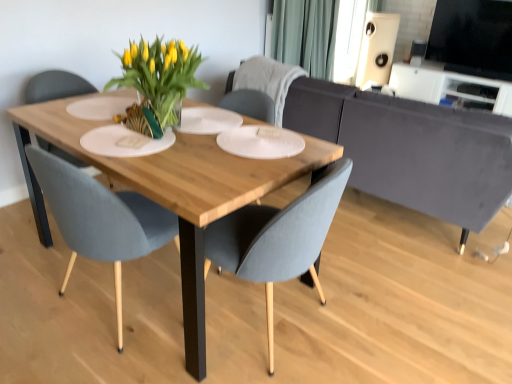
Where is `white matte window screen at upper center, the second window screen viewed from the front`? white matte window screen at upper center, the second window screen viewed from the front is located at coordinates pos(349,38).

Describe the element at coordinates (157, 82) in the screenshot. The image size is (512, 384). I see `yellow matte vase at upper center` at that location.

At what (x,y) coordinates should I click in order to perform the action: click on green fabric curtain at upper center. Please return your answer as a coordinate pair (x, y). The image size is (512, 384). Looking at the image, I should click on (305, 35).

Identify the location of natural wood table at center. The height and width of the screenshot is (384, 512). (173, 190).

Where is `white matte speaker at upper right`? white matte speaker at upper right is located at coordinates (377, 48).

Measure the distance between point (x=262, y=83) and camera.

The depth of point (x=262, y=83) is 2.91 meters.

I want to click on white matte window screen at upper center, which is counted as the second window screen, starting from the right, so click(349, 38).

This screenshot has width=512, height=384. I want to click on the 1st chair below the white matte speaker at upper right (from the image's perspective), so click(x=266, y=80).

From the image's perspective, relative to white matte speaker at upper right, is gray fabric chair at center, marked as the first chair in a back-to-front arrangement, above or below?

From the image's perspective, gray fabric chair at center, marked as the first chair in a back-to-front arrangement, appears below white matte speaker at upper right.

Can you tell me how much gray fabric chair at center, marked as the first chair in a back-to-front arrangement, and white matte speaker at upper right differ in facing direction?

gray fabric chair at center, marked as the first chair in a back-to-front arrangement, and white matte speaker at upper right are facing 180 degrees away from each other.

Looking at their sizes, would you say gray fabric chair at center, marked as the first chair in a back-to-front arrangement, is wider or thinner than white matte speaker at upper right?

Clearly, gray fabric chair at center, marked as the first chair in a back-to-front arrangement, has more width compared to white matte speaker at upper right.

Which object is closer to the camera, velvet grey couch at right or natural wood table at center?

natural wood table at center.

Can you tell me how much velvet grey couch at right and natural wood table at center differ in facing direction?

1.5 degrees separate the facing orientations of velvet grey couch at right and natural wood table at center.

From the image's perspective, is velvet grey couch at right located above natural wood table at center?

Yes, from the image's perspective, velvet grey couch at right is on top of natural wood table at center.

How distant is velvet grey couch at right from white matte window screen at upper center, acting as the 1th window screen starting from the left?

A distance of 2.78 meters exists between velvet grey couch at right and white matte window screen at upper center, acting as the 1th window screen starting from the left.

This screenshot has width=512, height=384. I want to click on the 2nd window screen above the velvet grey couch at right (from the image's perspective), so click(x=349, y=38).

Which is more to the right, velvet grey couch at right or white matte window screen at upper center, acting as the 1th window screen starting from the left?

white matte window screen at upper center, acting as the 1th window screen starting from the left, is more to the right.

How different are the orientations of velvet grey couch at right and white matte window screen at upper center, the second window screen viewed from the front, in degrees?

88.8 degrees.

Based on the photo, between black glossy tv at upper right, the 2th window screen viewed from the left, and white matte speaker at upper right, which one has larger width?

With larger width is white matte speaker at upper right.

Between black glossy tv at upper right, which is the first window screen from front to back, and white matte speaker at upper right, which one has more height?

Standing taller between the two is white matte speaker at upper right.

Would you say black glossy tv at upper right, which is the first window screen from front to back, contains white matte speaker at upper right?

Actually, white matte speaker at upper right is outside black glossy tv at upper right, which is the first window screen from front to back.

How different are the orientations of black glossy tv at upper right, acting as the second window screen starting from the back, and white matte speaker at upper right in degrees?

They differ by 0.0654 degrees in their facing directions.

Between black glossy tv at upper right, acting as the second window screen starting from the back, and matte gray chair at center, marked as the 2th chair in a back-to-front arrangement, which one is positioned in front?

Positioned in front is matte gray chair at center, marked as the 2th chair in a back-to-front arrangement.

Which object is positioned more to the left, black glossy tv at upper right, which is the first window screen from front to back, or matte gray chair at center, marked as the 2th chair in a back-to-front arrangement?

matte gray chair at center, marked as the 2th chair in a back-to-front arrangement.

Is black glossy tv at upper right, which is the first window screen from front to back, aimed at matte gray chair at center, which is the 2th chair from front to back?

Yes, black glossy tv at upper right, which is the first window screen from front to back, is oriented towards matte gray chair at center, which is the 2th chair from front to back.

Is point (437, 1) behind point (138, 209)?

Yes, it is behind point (138, 209).

From a real-world perspective, is matte gray chair at center, which is the 1th chair from front to back, positioned above or below black glossy tv at upper right, the 2th window screen viewed from the left?

matte gray chair at center, which is the 1th chair from front to back, is situated lower than black glossy tv at upper right, the 2th window screen viewed from the left, in the real world.

Who is more distant, matte gray chair at center, which is the 1th chair from front to back, or black glossy tv at upper right, acting as the second window screen starting from the back?

black glossy tv at upper right, acting as the second window screen starting from the back, is further away from the camera.

The width and height of the screenshot is (512, 384). In order to click on the 2nd chair counting from the left side of the black glossy tv at upper right, acting as the second window screen starting from the back in this screenshot , I will do `click(279, 237)`.

Is matte gray chair at center, which is the 1th chair from front to back, placed right next to black glossy tv at upper right, which is counted as the first window screen, starting from the right?

No, matte gray chair at center, which is the 1th chair from front to back, is not with black glossy tv at upper right, which is counted as the first window screen, starting from the right.

Is white matte speaker at upper right closer to camera compared to white matte window screen at upper center, which is counted as the second window screen, starting from the right?

No, it is not.

Where is `speaker that appears on the right of white matte window screen at upper center, acting as the 1th window screen starting from the back`? The width and height of the screenshot is (512, 384). speaker that appears on the right of white matte window screen at upper center, acting as the 1th window screen starting from the back is located at coordinates (377, 48).

Looking at this image, is white matte speaker at upper right oriented away from white matte window screen at upper center, acting as the 1th window screen starting from the left?

No, white matte speaker at upper right's orientation is not away from white matte window screen at upper center, acting as the 1th window screen starting from the left.

At what (x,y) coordinates should I click in order to perform the action: click on speaker that appears below the gray fabric chair at center, the 3th chair in the front-to-back sequence (from a real-world perspective). Please return your answer as a coordinate pair (x, y). The image size is (512, 384). Looking at the image, I should click on (377, 48).

Find the location of a particular element. The height and width of the screenshot is (384, 512). kitchen & dining room table that is in front of the velvet grey couch at right is located at coordinates (173, 190).

Based on their spatial positions, is yellow matte vase at upper center or white matte speaker at upper right closer to velvet grey couch at right?

Result: yellow matte vase at upper center is closer to velvet grey couch at right.

When comparing their distances from black glossy tv at upper right, which is counted as the first window screen, starting from the right, does natural wood table at center or velvet grey couch at right seem further?

Based on the image, natural wood table at center appears to be further to black glossy tv at upper right, which is counted as the first window screen, starting from the right.

Estimate the real-world distances between objects in this image. Which object is further from matte gray chair at center, marked as the 2th chair in a back-to-front arrangement, white matte speaker at upper right or black glossy tv at upper right, acting as the second window screen starting from the back?

black glossy tv at upper right, acting as the second window screen starting from the back, is positioned further to the anchor matte gray chair at center, marked as the 2th chair in a back-to-front arrangement.

Which object lies nearer to the anchor point matte gray chair at center, which is the 2th chair from front to back, green fabric curtain at upper center or gray fabric chair at center, the 3th chair in the front-to-back sequence?

A: gray fabric chair at center, the 3th chair in the front-to-back sequence, is positioned closer to the anchor matte gray chair at center, which is the 2th chair from front to back.

Which object lies nearer to the anchor point yellow matte vase at upper center, white matte speaker at upper right or white plastic entertainment center at upper right?

The object closer to yellow matte vase at upper center is white plastic entertainment center at upper right.

When comparing their distances from matte gray chair at center, marked as the 2th chair in a back-to-front arrangement, does white plastic entertainment center at upper right or velvet grey couch at right seem closer?

The object closer to matte gray chair at center, marked as the 2th chair in a back-to-front arrangement, is velvet grey couch at right.

From the image, which object appears to be nearer to yellow matte vase at upper center, white matte window screen at upper center, acting as the 1th window screen starting from the back, or white plastic entertainment center at upper right?

The object closer to yellow matte vase at upper center is white matte window screen at upper center, acting as the 1th window screen starting from the back.

Which object lies further to the anchor point gray fabric chair at center, marked as the first chair in a back-to-front arrangement, green fabric curtain at upper center or white matte speaker at upper right?

white matte speaker at upper right lies further to gray fabric chair at center, marked as the first chair in a back-to-front arrangement, than the other object.

Locate an element on the screen. Image resolution: width=512 pixels, height=384 pixels. couch located between matte gray chair at center, which is the 2th chair from front to back, and white plastic entertainment center at upper right in the depth direction is located at coordinates (411, 149).

At what (x,y) coordinates should I click in order to perform the action: click on houseplant located between matte gray chair at center, which is the 1th chair from front to back, and white plastic entertainment center at upper right in the depth direction. Please return your answer as a coordinate pair (x, y). This screenshot has height=384, width=512. Looking at the image, I should click on (157, 82).

Locate an element on the screen. This screenshot has width=512, height=384. entertainment center located between white matte window screen at upper center, the second window screen viewed from the front, and black glossy tv at upper right, which is the first window screen from front to back, in the left-right direction is located at coordinates (451, 87).

Identify the location of entertainment center positioned between yellow matte vase at upper center and white matte speaker at upper right from near to far. (451, 87).